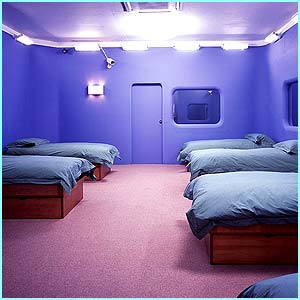
Where is `bed`? bed is located at coordinates (56, 176).